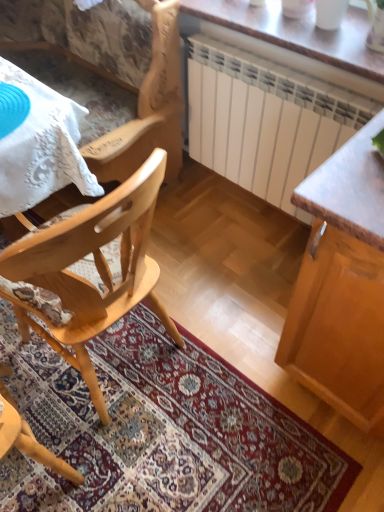
The height and width of the screenshot is (512, 384). What are the coordinates of `free space to the back side of carpeted mat at center` in the screenshot? It's located at (212, 249).